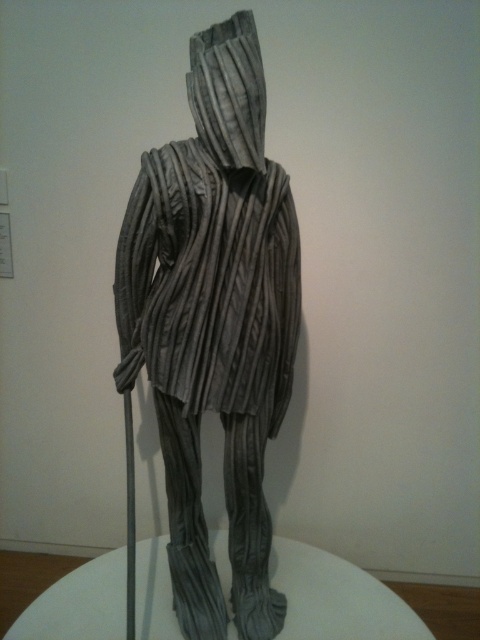
You are an art curator planning to install a new sculpture in a gallery. You notice the gray pleated fabric at center and the gray textured fabric hood at center in the sculpture. Which part of the sculpture is located to the left when viewed from the front?

The gray pleated fabric at center is positioned on the left side of the gray textured fabric hood at center, so the gray pleated fabric at center is to the left when viewed from the front.

You are an art curator planning to move the sculpture to a new exhibition space. The new space has a narrow doorway that is only 1 meter wide. Given the dimensions of the gray pleated fabric at center and the white glossy glass table at center, can the sculpture fit through the doorway without rotating it?

The gray pleated fabric at center is thinner than the white glossy glass table at center. However, the specific width of the sculpture is not provided, so it is uncertain whether it can fit through the 1 meter wide doorway without rotating it.

You are an art curator arranging a new exhibition. You need to place a small decorative item on the white glossy glass table at center so that it is visible from the front entrance. However, the gray pleated fabric at center might block the view. Is the small decorative item currently visible from the entrance?

The gray pleated fabric at center is in front of the white glossy glass table at center, so the small decorative item placed on the white glossy glass table at center would be blocked from view by the gray pleated fabric at center and thus not visible from the entrance.